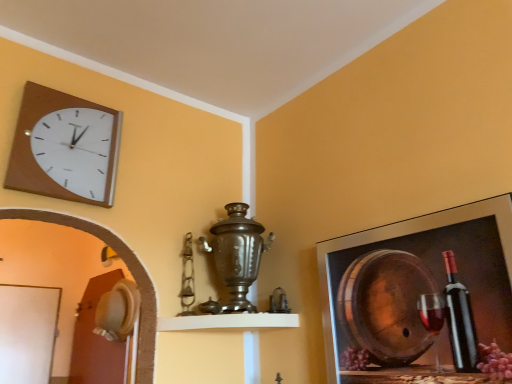
Question: From a real-world perspective, is matte brown clock at upper left above or below metallic frame at upper right?

Choices:
 (A) above
 (B) below

Answer: (A)

Question: Considering their positions, is matte brown clock at upper left located in front of or behind metallic frame at upper right?

Choices:
 (A) front
 (B) behind

Answer: (B)

Question: Considering the real-world distances, which object is farthest from the white matte shelf at center?

Choices:
 (A) metallic frame at upper right
 (B) matte brown clock at upper left

Answer: (B)

Question: Estimate the real-world distances between objects in this image. Which object is closer to the white matte shelf at center?

Choices:
 (A) matte brown clock at upper left
 (B) metallic frame at upper right

Answer: (B)